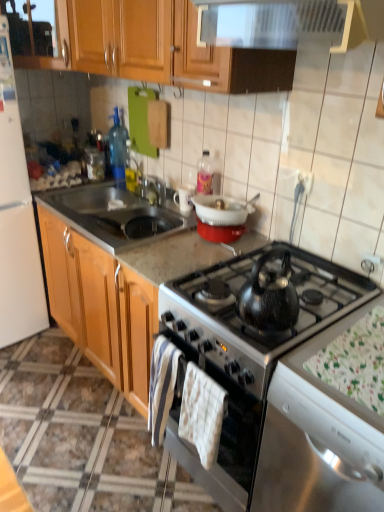
The width and height of the screenshot is (384, 512). I want to click on free spot above marble gray countertop at center (from a real-world perspective), so click(x=84, y=411).